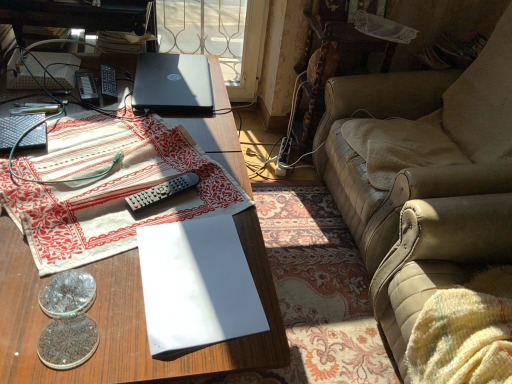
The image size is (512, 384). What are the coordinates of `vacant space that's between black plastic remote control at upper left, the 2th remote control when ordered from top to bottom, and white paper at center, the second paperback book when ordered from back to front` in the screenshot? It's located at (134, 168).